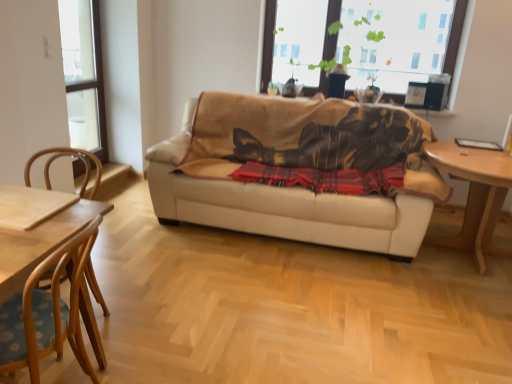
The image size is (512, 384). What are the coordinates of `free space between light wood chair at left, the 2th chair in the front-to-back sequence, and beige leather couch at center` in the screenshot? It's located at (223, 278).